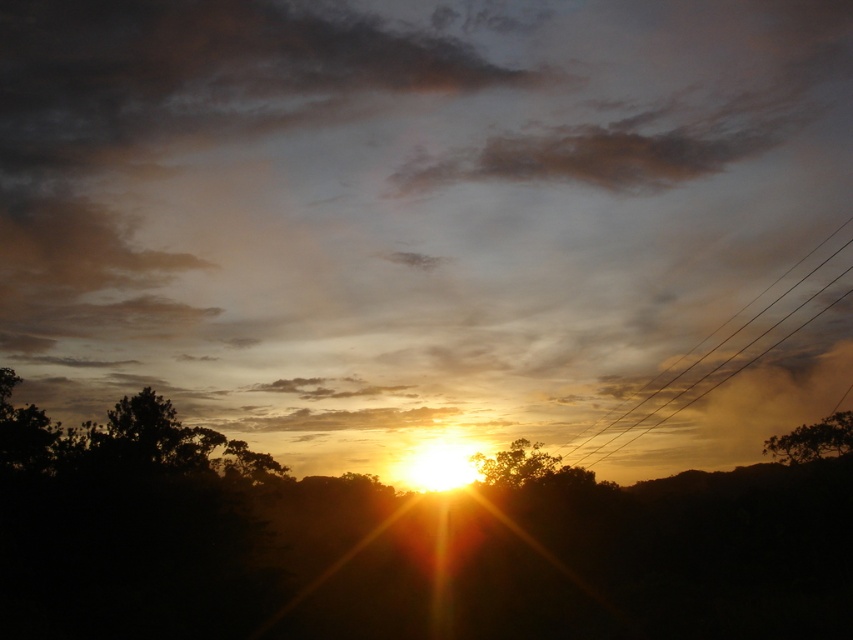
Question: Which object is the closest to the brown rough tree at right?

Choices:
 (A) matte orange cloud at center
 (B) silhouette leafy tree at center

Answer: (B)

Question: Can you confirm if matte orange cloud at center is bigger than brown rough tree at right?

Choices:
 (A) no
 (B) yes

Answer: (B)

Question: Which object is positioned closest to the brown rough tree at right?

Choices:
 (A) matte orange cloud at center
 (B) metallic wire at right

Answer: (B)

Question: Considering the real-world distances, which object is closest to the brown rough tree at right?

Choices:
 (A) matte orange cloud at center
 (B) metallic wire at right

Answer: (B)

Question: Can you confirm if metallic wire at right is positioned above silhouette leafy tree at center?

Choices:
 (A) yes
 (B) no

Answer: (A)

Question: Does matte orange cloud at center appear on the left side of silhouette leafy tree at center?

Choices:
 (A) no
 (B) yes

Answer: (B)